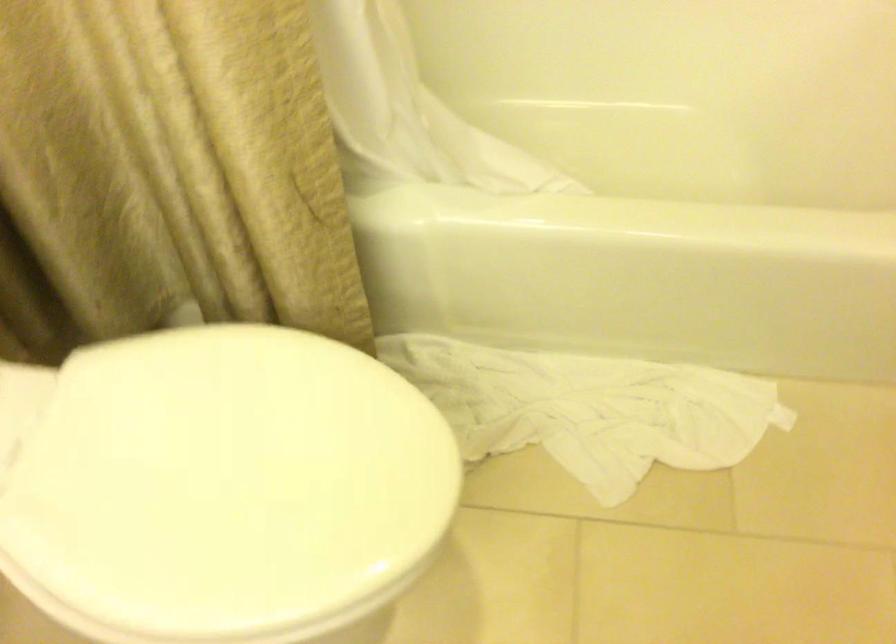
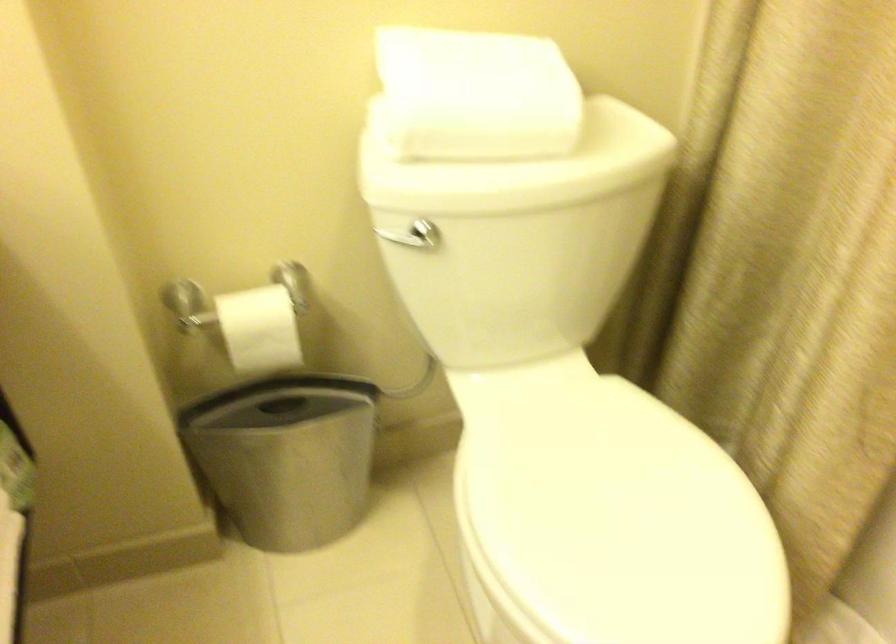
Where in the second image is the point corresponding to (229,469) from the first image?

(613, 518)